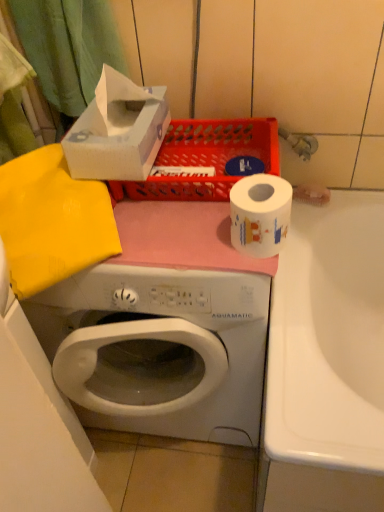
Question: Is white cardboard tissue box at upper left to the right of matte plastic basket at upper center from the viewer's perspective?

Choices:
 (A) no
 (B) yes

Answer: (A)

Question: Is white cardboard tissue box at upper left taller than matte plastic basket at upper center?

Choices:
 (A) yes
 (B) no

Answer: (A)

Question: Is white cardboard tissue box at upper left to the left of matte plastic basket at upper center from the viewer's perspective?

Choices:
 (A) yes
 (B) no

Answer: (A)

Question: From a real-world perspective, is white cardboard tissue box at upper left under matte plastic basket at upper center?

Choices:
 (A) yes
 (B) no

Answer: (B)

Question: Is white cardboard tissue box at upper left oriented away from matte plastic basket at upper center?

Choices:
 (A) no
 (B) yes

Answer: (A)

Question: From a real-world perspective, is white cardboard tissue box at upper left physically located above or below matte plastic basket at upper center?

Choices:
 (A) below
 (B) above

Answer: (B)

Question: Visually, is white cardboard tissue box at upper left positioned to the left or to the right of matte plastic basket at upper center?

Choices:
 (A) left
 (B) right

Answer: (A)

Question: From their relative heights in the image, would you say white cardboard tissue box at upper left is taller or shorter than matte plastic basket at upper center?

Choices:
 (A) short
 (B) tall

Answer: (B)

Question: Based on their sizes in the image, would you say white cardboard tissue box at upper left is bigger or smaller than matte plastic basket at upper center?

Choices:
 (A) big
 (B) small

Answer: (B)

Question: From a real-world perspective, is matte plastic basket at upper center physically located above or below white cardboard tissue box at upper left?

Choices:
 (A) above
 (B) below

Answer: (B)

Question: Considering the relative positions of matte plastic basket at upper center and white cardboard tissue box at upper left in the image provided, is matte plastic basket at upper center to the left or to the right of white cardboard tissue box at upper left?

Choices:
 (A) left
 (B) right

Answer: (B)

Question: Would you say matte plastic basket at upper center is inside or outside white cardboard tissue box at upper left?

Choices:
 (A) inside
 (B) outside

Answer: (B)

Question: Considering their positions, is matte plastic basket at upper center located in front of or behind white cardboard tissue box at upper left?

Choices:
 (A) front
 (B) behind

Answer: (B)

Question: Considering the positions of matte plastic basket at upper center and white glossy toilet paper at center in the image, is matte plastic basket at upper center taller or shorter than white glossy toilet paper at center?

Choices:
 (A) tall
 (B) short

Answer: (B)

Question: Looking at their shapes, would you say matte plastic basket at upper center is wider or thinner than white glossy toilet paper at center?

Choices:
 (A) thin
 (B) wide

Answer: (B)